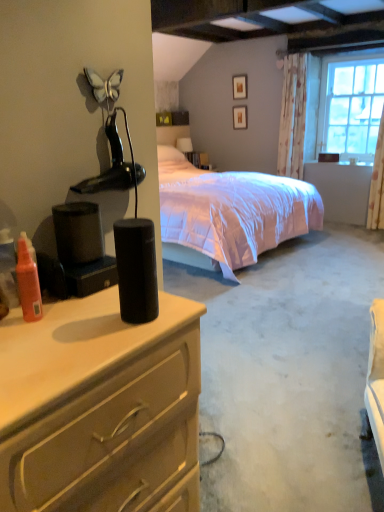
Find the location of a particular element. Image resolution: width=384 pixels, height=512 pixels. free space between translucent orange spray bottle at left and black matte speaker at center is located at coordinates (81, 318).